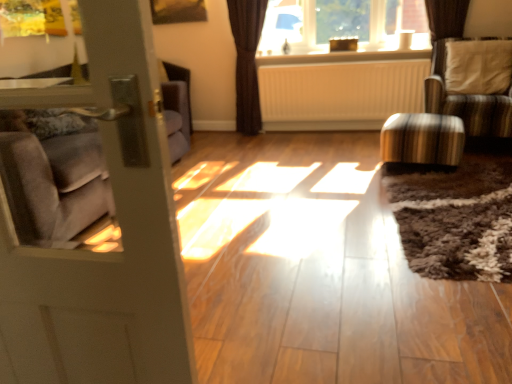
What do you see at coordinates (247, 61) in the screenshot? The image size is (512, 384). I see `brown textured curtain at upper center` at bounding box center [247, 61].

Where is `striped fabric chair at right`? striped fabric chair at right is located at coordinates (467, 101).

In order to face striped fabric chair at right, should I rotate leftwards or rightwards?

Rotate your view right by about 26.755°.

Describe the element at coordinates (422, 139) in the screenshot. I see `metallic striped stool at right` at that location.

Locate an element on the screen. metallic striped stool at right is located at coordinates (422, 139).

Find the location of a particular element. The height and width of the screenshot is (384, 512). white matte radiator at center is located at coordinates (340, 94).

The height and width of the screenshot is (384, 512). Find the location of `brown textured curtain at upper center`. brown textured curtain at upper center is located at coordinates (247, 61).

Is white textured pillow at upper right not within matte gray door at left?

Yes, white textured pillow at upper right is outside of matte gray door at left.

Based on the photo, considering the sizes of objects white textured pillow at upper right and matte gray door at left in the image provided, who is shorter, white textured pillow at upper right or matte gray door at left?

Standing shorter between the two is white textured pillow at upper right.

Which is more to the left, white textured pillow at upper right or matte gray door at left?

matte gray door at left.

Is clear glass window at upper center wider or thinner than matte gray door at left?

clear glass window at upper center is wider than matte gray door at left.

From the image's perspective, relative to matte gray door at left, is clear glass window at upper center above or below?

Clearly, from the image's perspective, clear glass window at upper center is above matte gray door at left.

Between clear glass window at upper center and matte gray door at left, which one is positioned behind?

clear glass window at upper center is behind.

Considering the sizes of objects clear glass window at upper center and matte gray door at left in the image provided, who is smaller, clear glass window at upper center or matte gray door at left?

With smaller size is matte gray door at left.

Based on their sizes in the image, would you say matte gray door at left is bigger or smaller than clear glass window at upper center?

Considering their sizes, matte gray door at left takes up less space than clear glass window at upper center.

Can you tell me how much matte gray door at left and clear glass window at upper center differ in facing direction?

There is a 179-degree angle between the facing directions of matte gray door at left and clear glass window at upper center.

Is matte gray door at left far away from clear glass window at upper center?

That's right, there is a large distance between matte gray door at left and clear glass window at upper center.

From the image's perspective, which is below, matte gray door at left or clear glass window at upper center?

matte gray door at left.

Is brown textured curtain at upper center smaller than white textured pillow at upper right?

Incorrect, brown textured curtain at upper center is not smaller in size than white textured pillow at upper right.

How much distance is there between brown textured curtain at upper center and white textured pillow at upper right?

They are 1.84 meters apart.

From a real-world perspective, which is physically above, brown textured curtain at upper center or white textured pillow at upper right?

In real-world perspective, white textured pillow at upper right is above.

Is brown textured curtain at upper center not within white textured pillow at upper right?

Yes, brown textured curtain at upper center is outside of white textured pillow at upper right.

Which of these two, clear glass window at upper center or white textured pillow at upper right, stands shorter?

Standing shorter between the two is clear glass window at upper center.

From the image's perspective, is clear glass window at upper center located above white textured pillow at upper right?

Correct, clear glass window at upper center appears higher than white textured pillow at upper right in the image.

In the scene shown: Is clear glass window at upper center directly adjacent to white textured pillow at upper right?

They are not placed beside each other.

How much distance is there between clear glass window at upper center and white textured pillow at upper right?

clear glass window at upper center is 34.41 inches away from white textured pillow at upper right.

Who is shorter, white textured pillow at upper right or clear glass window at upper center?

clear glass window at upper center.

From the picture: Is white textured pillow at upper right positioned with its back to clear glass window at upper center?

white textured pillow at upper right is not turned away from clear glass window at upper center.

Can clear glass window at upper center be found inside white textured pillow at upper right?

Answer: Actually, clear glass window at upper center is outside white textured pillow at upper right.

Who is smaller, white textured pillow at upper right or clear glass window at upper center?

With smaller size is white textured pillow at upper right.

Could you tell me if metallic striped stool at right is turned towards matte gray door at left?

Yes.

Which is farther, (460,156) or (81,257)?

The point (460,156) is farther.

Image resolution: width=512 pixels, height=384 pixels. What are the coordinates of `door above the metallic striped stool at right (from a real-world perspective)` in the screenshot? It's located at (106, 252).

Relative to matte gray door at left, is metallic striped stool at right in front or behind?

metallic striped stool at right is positioned farther from the viewer than matte gray door at left.

I want to click on door on the left of white textured pillow at upper right, so click(x=106, y=252).

Where is `door that is under the clear glass window at upper center (from a real-world perspective)`? door that is under the clear glass window at upper center (from a real-world perspective) is located at coordinates click(106, 252).

Considering their positions, is metallic striped stool at right positioned further to clear glass window at upper center than matte gray door at left?

matte gray door at left is positioned further to the anchor clear glass window at upper center.

When comparing their distances from white matte radiator at center, does metallic striped stool at right or striped fabric chair at right seem further?

metallic striped stool at right is positioned further to the anchor white matte radiator at center.

Based on their spatial positions, is metallic striped stool at right or white matte radiator at center closer to brown textured curtain at upper center?

Among the two, white matte radiator at center is located nearer to brown textured curtain at upper center.

Estimate the real-world distances between objects in this image. Which object is closer to metallic striped stool at right, clear glass window at upper center or white textured pillow at upper right?

white textured pillow at upper right lies closer to metallic striped stool at right than the other object.

Estimate the real-world distances between objects in this image. Which object is closer to metallic striped stool at right, white textured pillow at upper right or white matte radiator at center?

The object closer to metallic striped stool at right is white textured pillow at upper right.

When comparing their distances from striped fabric chair at right, does brown textured curtain at upper center or white matte radiator at center seem further?

The object further to striped fabric chair at right is brown textured curtain at upper center.

When comparing their distances from matte gray door at left, does white matte radiator at center or metallic striped stool at right seem closer?

Based on the image, metallic striped stool at right appears to be nearer to matte gray door at left.

Considering their positions, is metallic striped stool at right positioned closer to white matte radiator at center than clear glass window at upper center?

clear glass window at upper center is positioned closer to the anchor white matte radiator at center.

You are a GUI agent. You are given a task and a screenshot of the screen. Output one action in this format:
    pyautogui.click(x=<x>, y=<y>)
    Task: Click on the window between metallic striped stool at right and white matte radiator at center in the front-back direction
    
    Given the screenshot: What is the action you would take?
    pyautogui.click(x=341, y=25)

This screenshot has height=384, width=512. Find the location of `stool between matte gray door at left and white matte radiator at center from front to back`. stool between matte gray door at left and white matte radiator at center from front to back is located at coordinates (422, 139).

Locate an element on the screen. chair between clear glass window at upper center and metallic striped stool at right vertically is located at coordinates (467, 101).

Image resolution: width=512 pixels, height=384 pixels. I want to click on window between matte gray door at left and white matte radiator at center from front to back, so click(341, 25).